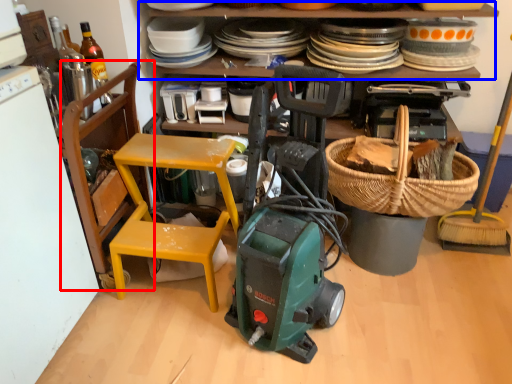
Question: Among these objects, which one is nearest to the camera, chair (highlighted by a red box) or shelf (highlighted by a blue box)?

Choices:
 (A) chair
 (B) shelf

Answer: (A)